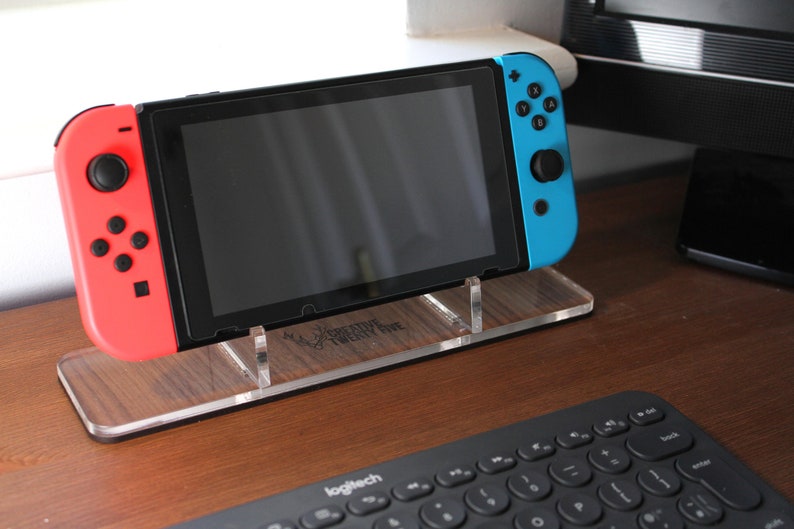
Where is `computer monitor`? Image resolution: width=794 pixels, height=529 pixels. computer monitor is located at coordinates (766, 34).